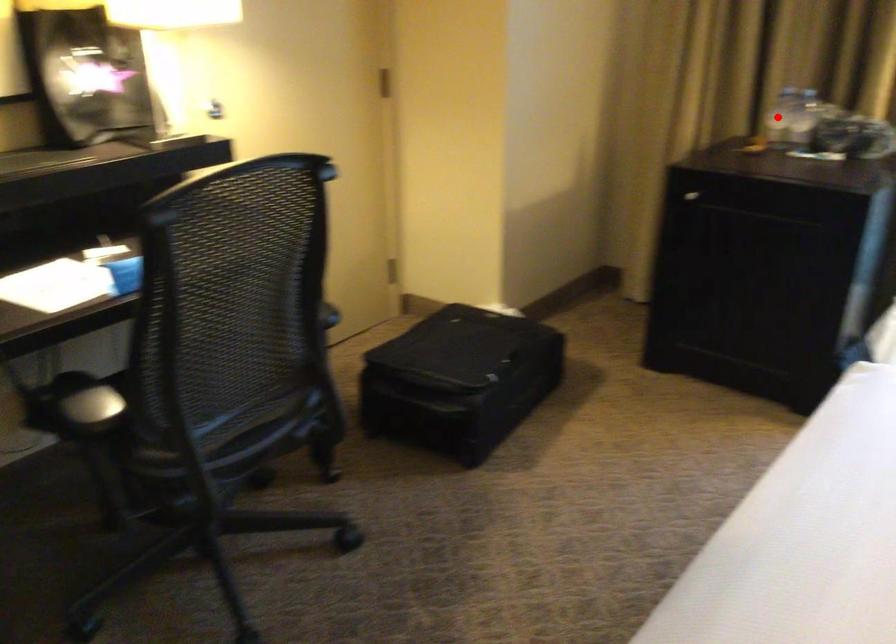
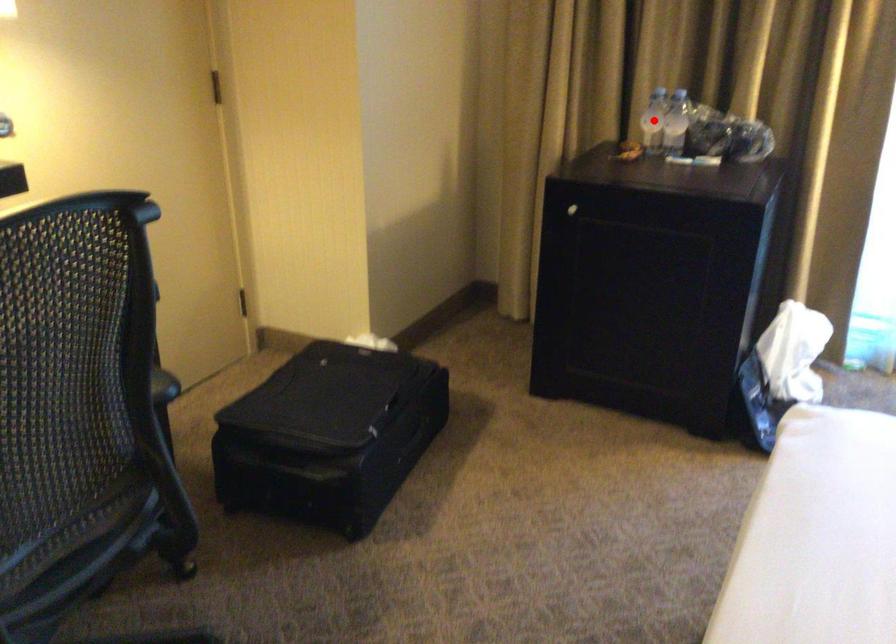
I am providing you with two images of the same scene from different viewpoints. A red point is marked on the first image and another point is marked on the second image. Is the red point in image1 aligned with the point shown in image2?

Yes